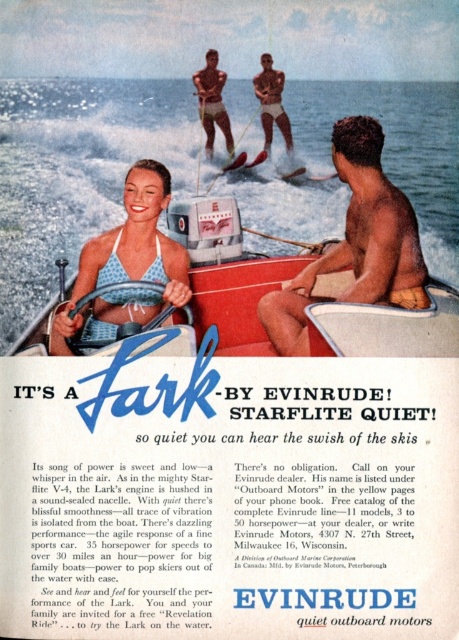
You are a photographer positioned at the origin point of the image coordinate system. You want to capture a photo that includes both the point at (374, 224) and the point at (161, 186). Based on their positions, which point is closer to the camera?

Point (374, 224) is in front of point (161, 186), so it is closer to the camera.

You are a photographer positioned at the edge of the water, aiming to capture a photo of both the matte brown skin at center and the smooth tan skin at center in the same frame. Given that your camera has a maximum focus range of 12 meters, will you be able to include both subjects in sharp focus?

The distance between the matte brown skin at center and the smooth tan skin at center is 13.11 meters. Since the camera can only focus up to 12 meters, both subjects cannot be in sharp focus simultaneously.

You are standing on the dock and want to reach the point marked as point (393, 288) in the image. If your maximum comfortable walking distance is 20 meters, can you comfortably walk to that point?

The distance of point (393, 288) from viewer is 17.75 meters, so yes, you can comfortably walk to that point since it is within your 20 meters limit.